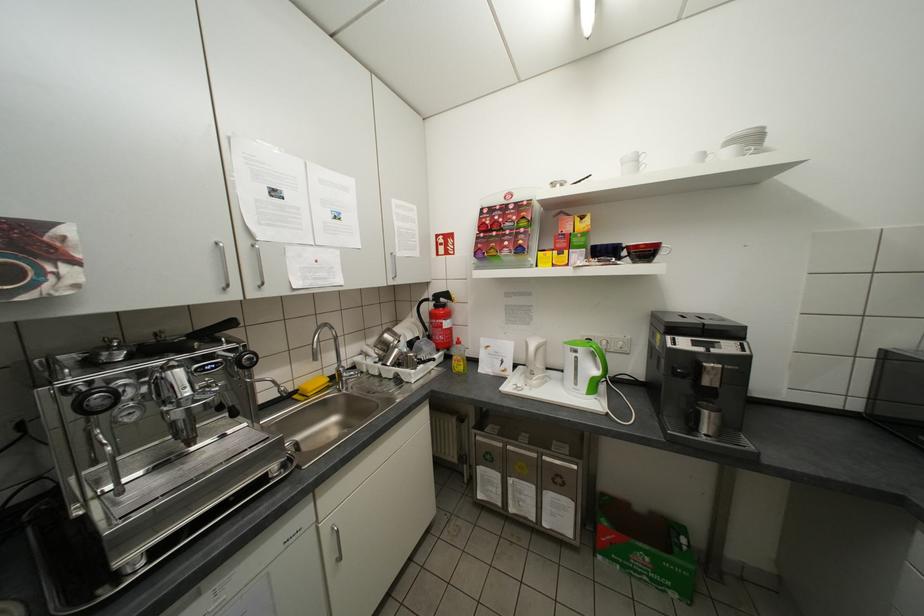
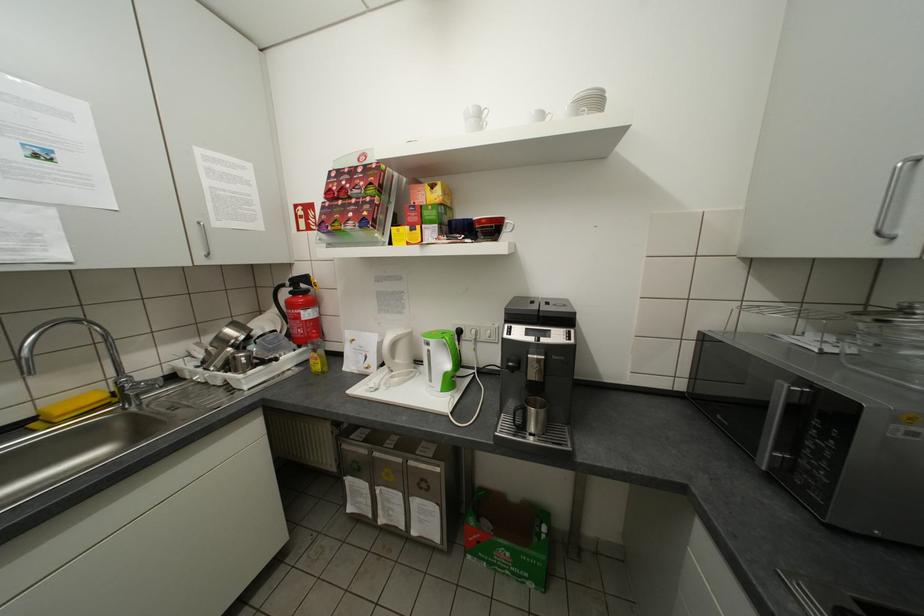
Question: The camera is either moving clockwise (left) or counter-clockwise (right) around the object. The first image is from the beginning of the video and the second image is from the end. Is the camera moving left or right when shooting the video?

Choices:
 (A) Left
 (B) Right

Answer: (A)